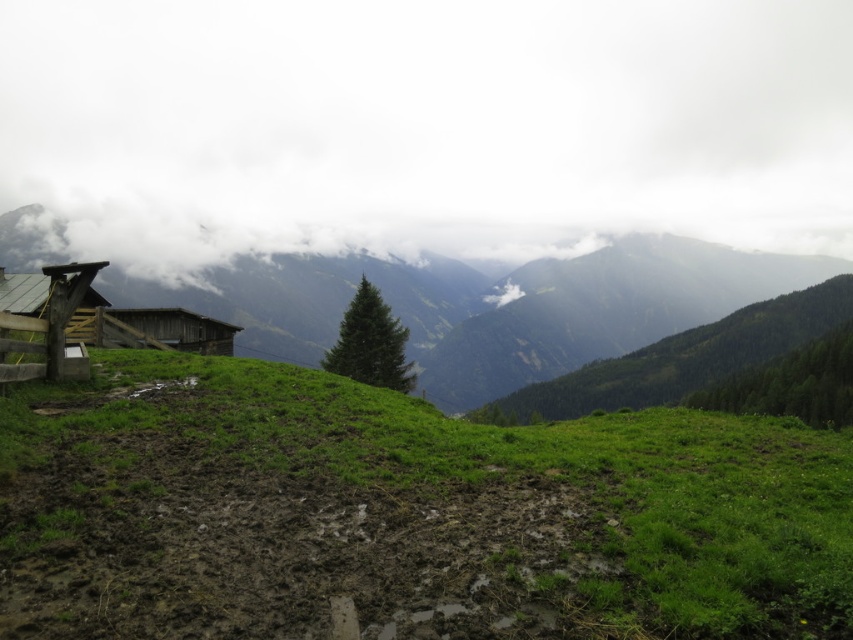
Question: Which point is farther from the camera taking this photo?

Choices:
 (A) (746, 289)
 (B) (244, 630)
 (C) (64, 58)

Answer: (C)

Question: Which point is farther to the camera?

Choices:
 (A) wooden cabin at left
 (B) green grassy hillside at left
 (C) white fluffy cloud at upper center
 (D) green grassy at lower left

Answer: (C)

Question: Does green grassy at lower left appear on the left side of green grassy hillside at left?

Choices:
 (A) yes
 (B) no

Answer: (A)

Question: Based on their relative distances, which object is nearer to the green grassy hillside at left?

Choices:
 (A) wooden cabin at left
 (B) white fluffy cloud at upper center
 (C) green grassy at lower left

Answer: (C)

Question: Can you confirm if white fluffy cloud at upper center is smaller than wooden cabin at left?

Choices:
 (A) yes
 (B) no

Answer: (B)

Question: Can you confirm if white fluffy cloud at upper center is positioned below green grassy hillside at left?

Choices:
 (A) yes
 (B) no

Answer: (B)